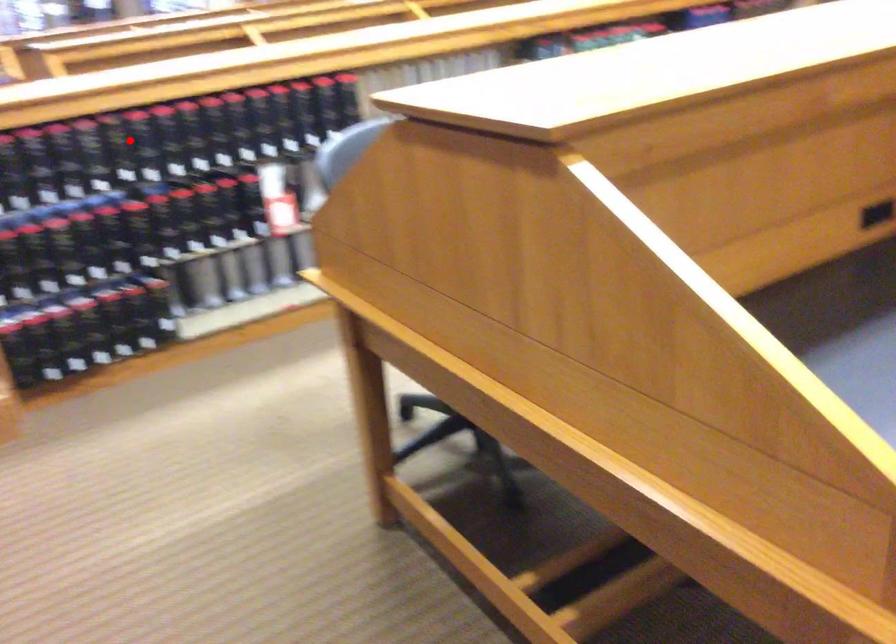
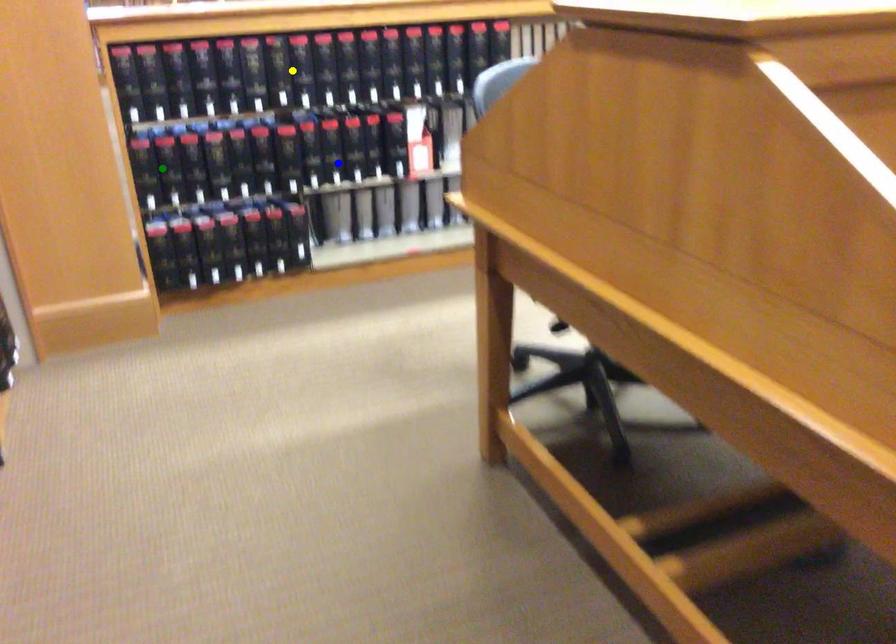
Question: I am providing you with two images of the same scene from different viewpoints. A red point is marked on the first image. You are given multiple points on the second image. Which point in image 2 represents the same 3d spot as the red point in image 1?

Choices:
 (A) yellow point
 (B) green point
 (C) blue point

Answer: (A)